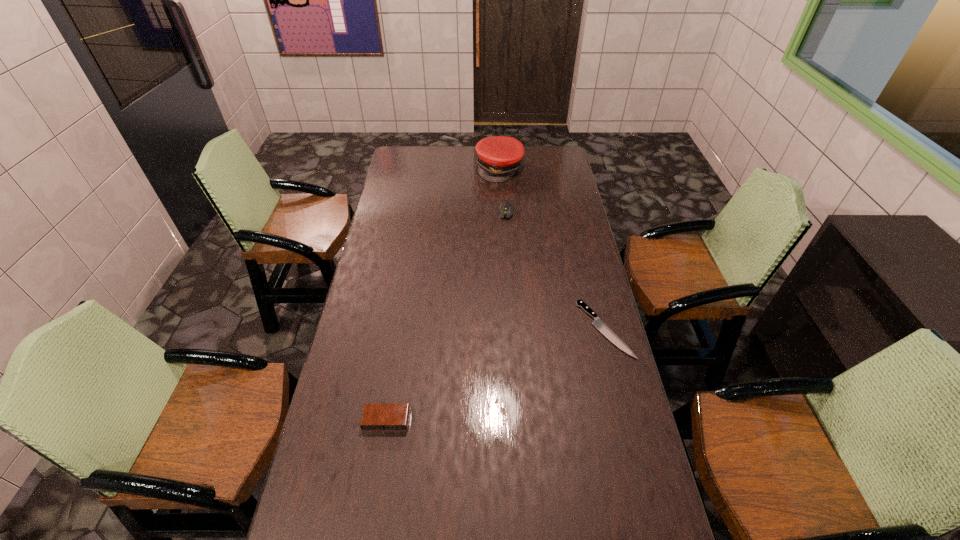
In the image, there is a desktop. In order to click on vacant region at the near edge in this screenshot , I will do `click(463, 517)`.

Identify the location of free region at the left edge. This screenshot has height=540, width=960. (361, 347).

This screenshot has width=960, height=540. I want to click on vacant space at the right edge, so click(636, 436).

Where is `vacant space at the far left corner of the desktop`? Image resolution: width=960 pixels, height=540 pixels. vacant space at the far left corner of the desktop is located at coordinates (418, 153).

The image size is (960, 540). Find the location of `vacant space at the near left corner of the desktop`. vacant space at the near left corner of the desktop is located at coordinates (360, 526).

Image resolution: width=960 pixels, height=540 pixels. In the image, there is a desktop. Identify the location of vacant region at the far right corner. (563, 165).

Identify the location of free space between the second farthest object and the third farthest object. (556, 271).

Image resolution: width=960 pixels, height=540 pixels. Find the location of `vacant area that lies between the rightmost object and the second shortest object`. vacant area that lies between the rightmost object and the second shortest object is located at coordinates (495, 375).

This screenshot has width=960, height=540. In order to click on free space between the computer mouse and the tallest object in this screenshot , I will do `click(503, 190)`.

The image size is (960, 540). In order to click on unoccupied position between the rightmost object and the second tallest object in this screenshot , I will do `click(556, 271)`.